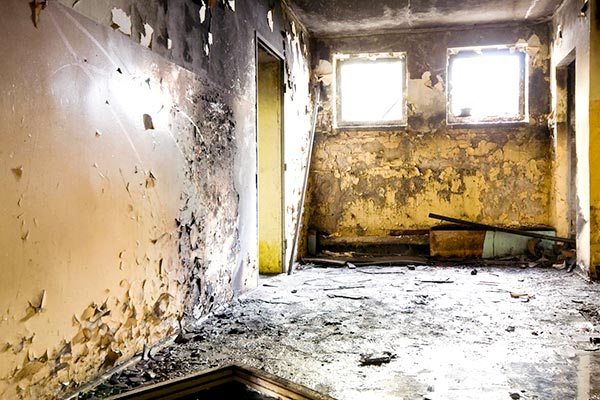
Identify the location of floor. (447, 335).